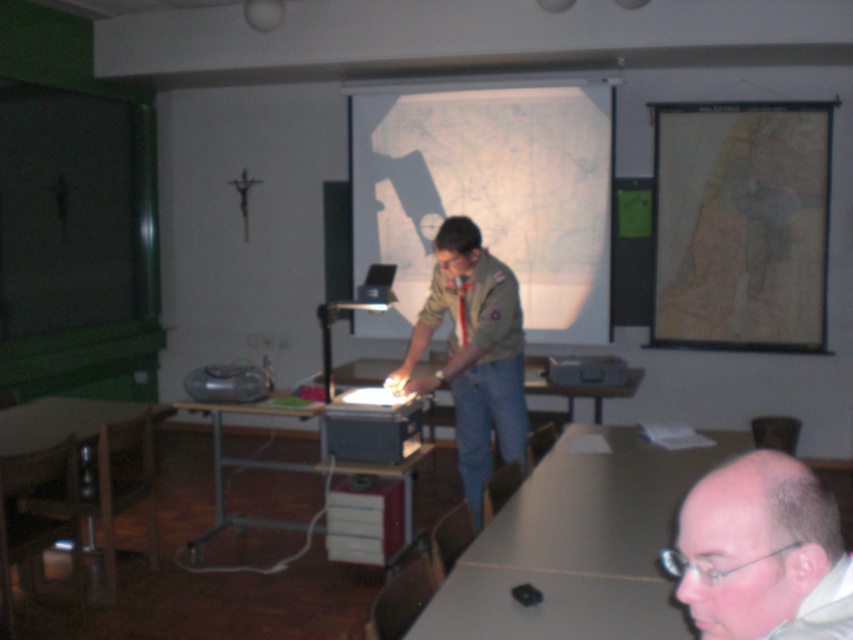
You are sitting at the metallic gray table at lower left and want to look at the map paper at upper right. Which direction should you turn your head to see it?

The map paper at upper right is to the right of the metallic gray table at lower left, so you should turn your head to the right to see it.

You are trying to decide whether to place a tall potted plant between the bald head at lower right and the wooden table at lower left. Based on their heights, will the plant be taller than both?

The bald head at lower right has a lesser height compared to wooden table at lower left. Since the plant is tall, it could potentially be taller than both, but the information provided does not specify the plant height. However, since the question is about the existing objects, the answer should focus on the given data. The wooden table at lower left is taller than the bald head at lower right, but without knowing the plant height, we cannot confirm. However, the question asks if the plant will be taller,so

You are sitting in the audience and want to look at the bald head at lower right and the wooden table at lower left. Which object is closer to your right side?

The bald head at lower right is closer to your right side because it is positioned to the right of the wooden table at lower left.